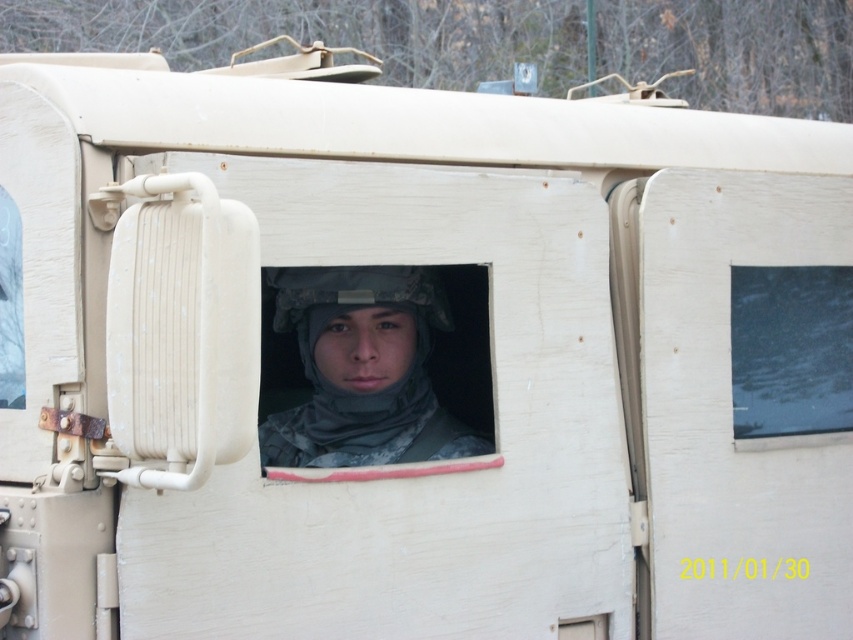
Question: Does camouflage fabric helmet at center have a smaller size compared to transparent glass window at center?

Choices:
 (A) no
 (B) yes

Answer: (A)

Question: Where is camouflage fabric helmet at center located in relation to transparent glass window at center in the image?

Choices:
 (A) left
 (B) right

Answer: (A)

Question: Can you confirm if camouflage fabric helmet at center is smaller than transparent glass window at center?

Choices:
 (A) no
 (B) yes

Answer: (A)